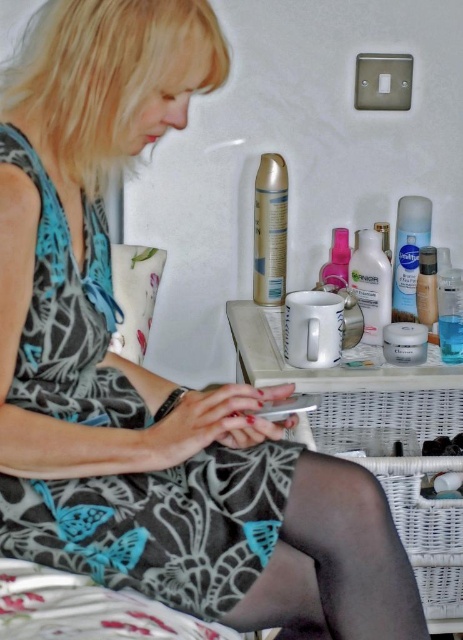
You are a fashion designer observing the scene. You need to determine which item is bigger between the printed fabric dress at center and the matte plastic spray can at upper right. Which one is larger?

The printed fabric dress at center is larger in size than the matte plastic spray can at upper right.

You are a delivery robot that is 0.5 meters wide. You need to deliver a package to the white glossy lotion at center. The path between you and the lotion is clear except for the side table. Can you reach the lotion without moving the side table?

The distance between the white glossy lotion at center and the viewer is 1.34 meters. Since the robot is 0.5 meters wide and the path is clear except for the side table, the robot can navigate to the lotion as long as there is enough space around the table. However, the question specifies not moving the table, so assuming the path around it allows passage, the robot can reach the lotion.